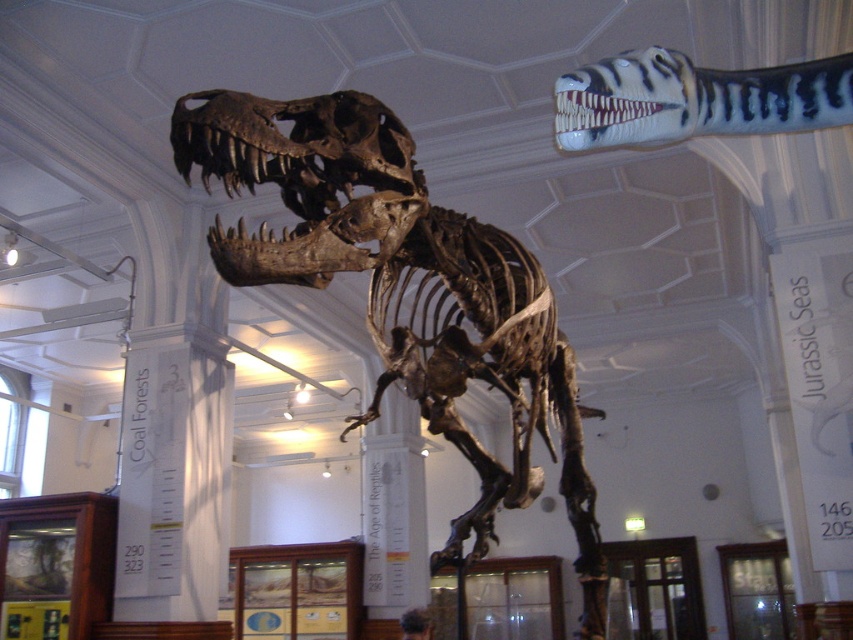
You are a museum visitor standing in front of the T. rex skeleton. There is a point marked at coordinates (405, 289). Can you identify what this point corresponds to in the scene?

The point at coordinates (405, 289) corresponds to the brown bone skeleton at center.

You are a museum visitor standing in the center of the exhibit. You want to take a photo of the brown bone skeleton at center without any obstructions. Are there any display cases or informational panels blocking your view? Please explain.

The brown bone skeleton at center is located at point (405, 289), which is in the center of the exhibit. Since the display cases and informational panels are positioned to the left and right backgrounds, they are not directly in front of the skeleton. Therefore, you can take a clear photo of the brown bone skeleton at center without obstructions.